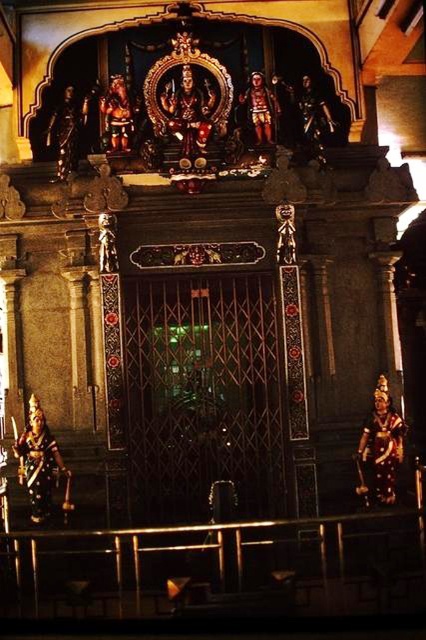
Question: Is polished bronze statue at lower right below polished bronze statue at lower left?

Choices:
 (A) no
 (B) yes

Answer: (A)

Question: Which object appears closest to the camera in this image?

Choices:
 (A) polished bronze statue at lower left
 (B) polished bronze statue at lower right

Answer: (A)

Question: Is polished bronze statue at lower right above polished bronze statue at lower left?

Choices:
 (A) yes
 (B) no

Answer: (A)

Question: Which of the following is the closest to the observer?

Choices:
 (A) polished bronze statue at lower right
 (B) polished bronze statue at lower left

Answer: (B)

Question: Considering the relative positions of polished bronze statue at lower right and polished bronze statue at lower left in the image provided, where is polished bronze statue at lower right located with respect to polished bronze statue at lower left?

Choices:
 (A) below
 (B) above

Answer: (B)